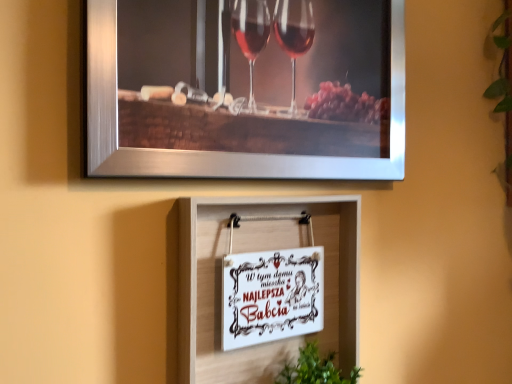
Question: From a real-world perspective, is metallic silver picture frame at upper center, positioned as the third picture frame in bottom-to-top order, physically located above or below white paper sign at center, which appears as the 2th picture frame when ordered from the bottom?

Choices:
 (A) below
 (B) above

Answer: (B)

Question: In the image, is metallic silver picture frame at upper center, the 1th picture frame viewed from the top, on the left side or the right side of white paper sign at center, which appears as the 2th picture frame when ordered from the bottom?

Choices:
 (A) left
 (B) right

Answer: (B)

Question: Estimate the real-world distances between objects in this image. Which object is closer to the metallic silver picture frame at upper center, positioned as the third picture frame in bottom-to-top order?

Choices:
 (A) green leafy plant at lower center
 (B) white paper sign at center, which is the second picture frame from top to bottom
 (C) white paper sign at center, marked as the 3th picture frame in a top-to-bottom arrangement

Answer: (C)

Question: Estimate the real-world distances between objects in this image. Which object is closer to the white paper sign at center, which appears as the 2th picture frame when ordered from the bottom?

Choices:
 (A) metallic silver picture frame at upper center, the 1th picture frame viewed from the top
 (B) green leafy plant at lower center
 (C) white paper sign at center, marked as the 3th picture frame in a top-to-bottom arrangement

Answer: (C)